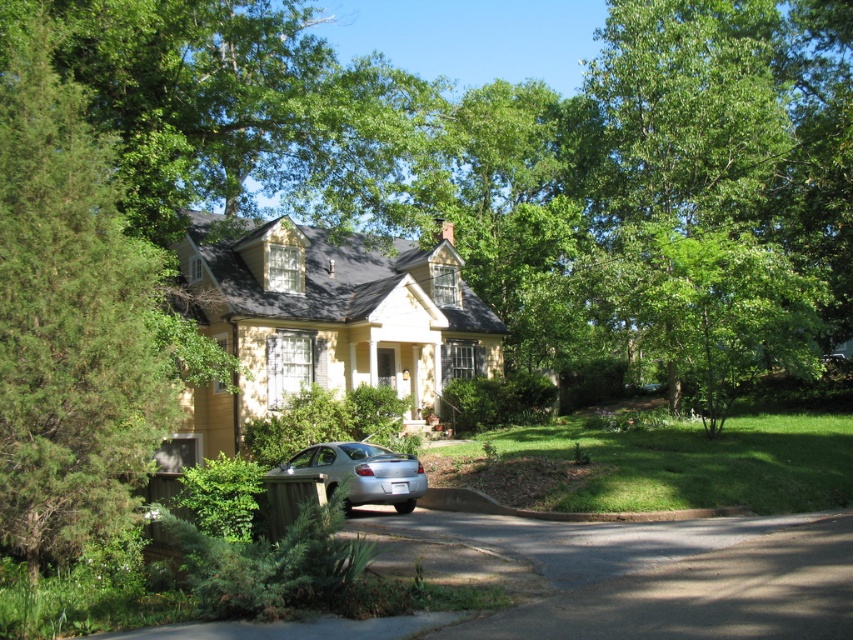
Which is below, black asphalt driveway at lower center or brown concrete curb at lower center?

brown concrete curb at lower center is below.

Can you confirm if black asphalt driveway at lower center is taller than brown concrete curb at lower center?

Incorrect, black asphalt driveway at lower center's height is not larger of brown concrete curb at lower center's.

Who is more distant from viewer, (811, 580) or (735, 513)?

Positioned behind is point (735, 513).

Locate an element on the screen. black asphalt driveway at lower center is located at coordinates (701, 595).

Locate an element on the screen. silver metallic sedan at lower left is located at coordinates (361, 472).

Is point (393, 477) less distant than point (614, 518)?

No, it is not.

The image size is (853, 640). Describe the element at coordinates (361, 472) in the screenshot. I see `silver metallic sedan at lower left` at that location.

You are a GUI agent. You are given a task and a screenshot of the screen. Output one action in this format:
    pyautogui.click(x=<x>, y=<y>)
    Task: Click on the silver metallic sedan at lower left
    
    Given the screenshot: What is the action you would take?
    pyautogui.click(x=361, y=472)

Is point (805, 604) farther from camera compared to point (372, 474)?

No, it is not.

Who is positioned more to the right, black asphalt driveway at lower center or silver metallic sedan at lower left?

From the viewer's perspective, black asphalt driveway at lower center appears more on the right side.

Image resolution: width=853 pixels, height=640 pixels. Describe the element at coordinates (701, 595) in the screenshot. I see `black asphalt driveway at lower center` at that location.

At what (x,y) coordinates should I click in order to perform the action: click on black asphalt driveway at lower center. Please return your answer as a coordinate pair (x, y). The width and height of the screenshot is (853, 640). Looking at the image, I should click on (701, 595).